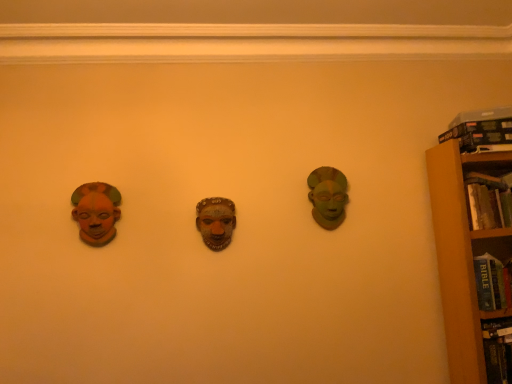
Question: Is hardcover book at right, which is counted as the 2th book, starting from the top, in front of hardcover book at upper right, the first book positioned from the top?

Choices:
 (A) yes
 (B) no

Answer: (A)

Question: Is hardcover book at right, arranged as the 1th book when ordered from the bottom, next to hardcover book at upper right, the first book positioned from the top, and touching it?

Choices:
 (A) yes
 (B) no

Answer: (B)

Question: From a real-world perspective, does hardcover book at right, which is counted as the 2th book, starting from the top, sit lower than hardcover book at upper right, the first book positioned from the top?

Choices:
 (A) yes
 (B) no

Answer: (A)

Question: Is hardcover book at right, arranged as the 1th book when ordered from the bottom, looking in the opposite direction of hardcover book at upper right, acting as the 2th book starting from the bottom?

Choices:
 (A) yes
 (B) no

Answer: (B)

Question: Does hardcover book at right, arranged as the 1th book when ordered from the bottom, have a lesser width compared to hardcover book at upper right, acting as the 2th book starting from the bottom?

Choices:
 (A) no
 (B) yes

Answer: (A)

Question: From the image's perspective, is brown wooden bookcase at right positioned above or below matte orange mask at left, the first head in the front-to-back sequence?

Choices:
 (A) below
 (B) above

Answer: (A)

Question: Choose the correct answer: Is brown wooden bookcase at right inside matte orange mask at left, the 2th head from the right, or outside it?

Choices:
 (A) inside
 (B) outside

Answer: (B)

Question: In the image, is brown wooden bookcase at right positioned in front of or behind matte orange mask at left, the first head in the front-to-back sequence?

Choices:
 (A) behind
 (B) front

Answer: (B)

Question: From a real-world perspective, relative to matte orange mask at left, acting as the second head starting from the back, is brown wooden bookcase at right vertically above or below?

Choices:
 (A) below
 (B) above

Answer: (A)

Question: Is matte orange mask at left, acting as the second head starting from the back, wider or thinner than hardcover book at right, which is counted as the 2th book, starting from the top?

Choices:
 (A) wide
 (B) thin

Answer: (B)

Question: Would you say matte orange mask at left, which appears as the first head when viewed from the left, is inside or outside hardcover book at right, which is counted as the 2th book, starting from the top?

Choices:
 (A) inside
 (B) outside

Answer: (B)

Question: From a real-world perspective, relative to hardcover book at right, arranged as the 1th book when ordered from the bottom, is matte orange mask at left, the 2th head from the right, vertically above or below?

Choices:
 (A) above
 (B) below

Answer: (A)

Question: Is point (93, 226) positioned closer to the camera than point (502, 221)?

Choices:
 (A) farther
 (B) closer

Answer: (B)

Question: Is point pyautogui.click(x=90, y=213) positioned closer to the camera than point pyautogui.click(x=479, y=132)?

Choices:
 (A) closer
 (B) farther

Answer: (A)

Question: Is matte orange mask at left, which appears as the first head when viewed from the left, situated inside hardcover book at upper right, acting as the 2th book starting from the bottom, or outside?

Choices:
 (A) outside
 (B) inside

Answer: (A)